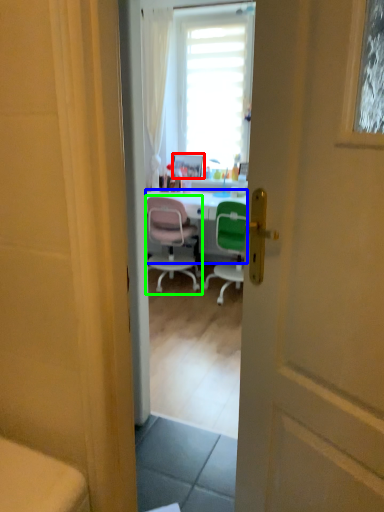
Question: Considering the real-world distances, which object is farthest from picture frame (highlighted by a red box)? desk (highlighted by a blue box) or chair (highlighted by a green box)?

Choices:
 (A) desk
 (B) chair

Answer: (B)